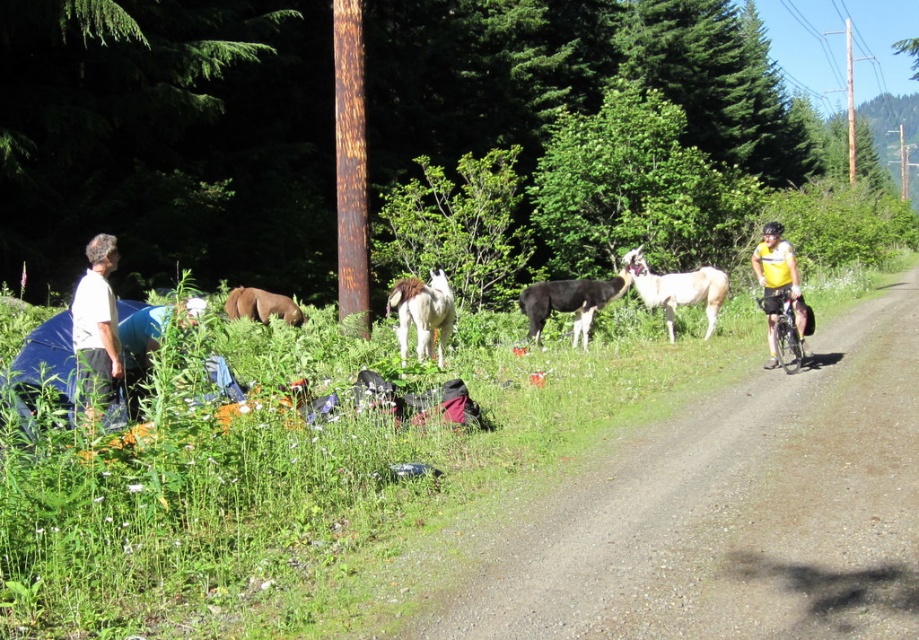
Between black woolen goat at center and white woolen goat at right, which one appears on the right side from the viewer's perspective?

white woolen goat at right

Does black woolen goat at center have a lesser height compared to white woolen goat at right?

No.

Is point (598, 285) behind point (642, 269)?

No, it is in front of (642, 269).

This screenshot has width=919, height=640. I want to click on black woolen goat at center, so click(573, 300).

Which is more to the right, white cotton shirt at left or black woolen goat at center?

From the viewer's perspective, black woolen goat at center appears more on the right side.

Between white cotton shirt at left and black woolen goat at center, which one has more height?

black woolen goat at center

Is point (93, 266) farther from viewer compared to point (588, 333)?

No, it is not.

At what (x,y) coordinates should I click in order to perform the action: click on white cotton shirt at left. Please return your answer as a coordinate pair (x, y). Looking at the image, I should click on (97, 326).

Is white fluffy pony at center smaller than brown fuzzy pony at lower left?

No, white fluffy pony at center is not smaller than brown fuzzy pony at lower left.

Describe the element at coordinates (423, 314) in the screenshot. This screenshot has width=919, height=640. I see `white fluffy pony at center` at that location.

I want to click on white fluffy pony at center, so (423, 314).